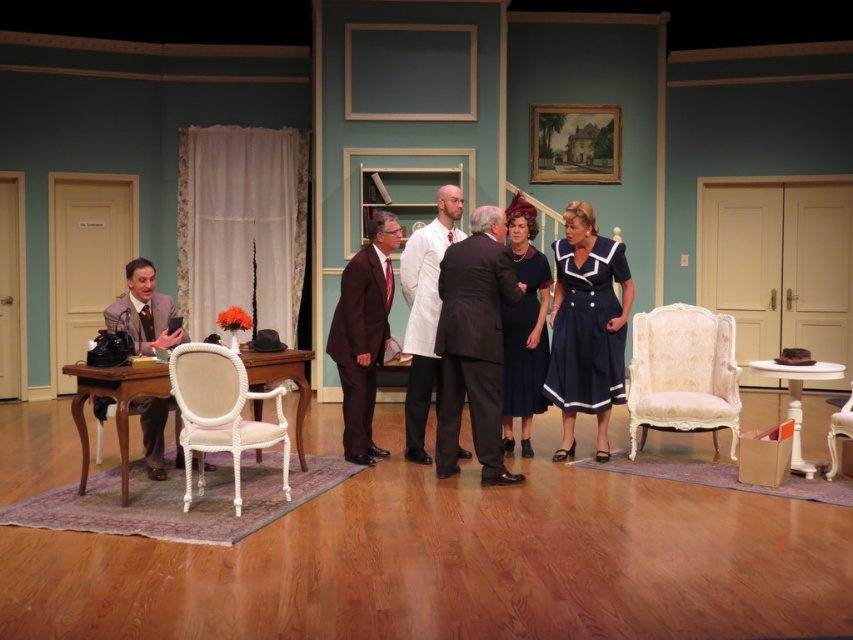
Does navy blue fabric dress at center have a lesser height compared to white matte coat at center?

Yes, navy blue fabric dress at center is shorter than white matte coat at center.

Between point (618, 381) and point (422, 253), which one is positioned in front?

Point (618, 381)

Identify the location of navy blue fabric dress at center. (587, 326).

Can you confirm if dark gray suit at center is thinner than matte brown suit at left?

No, dark gray suit at center is not thinner than matte brown suit at left.

How much distance is there between dark gray suit at center and matte brown suit at left?

dark gray suit at center is 6.84 feet away from matte brown suit at left.

Locate an element on the screen. This screenshot has height=640, width=853. dark gray suit at center is located at coordinates (474, 344).

Can you confirm if dark gray suit at center is bigger than white upholstered chair at right?

Yes, dark gray suit at center is bigger than white upholstered chair at right.

Between point (448, 324) and point (828, 433), which one is positioned behind?

The point (828, 433) is behind.

Identify the location of dark gray suit at center. The width and height of the screenshot is (853, 640). (474, 344).